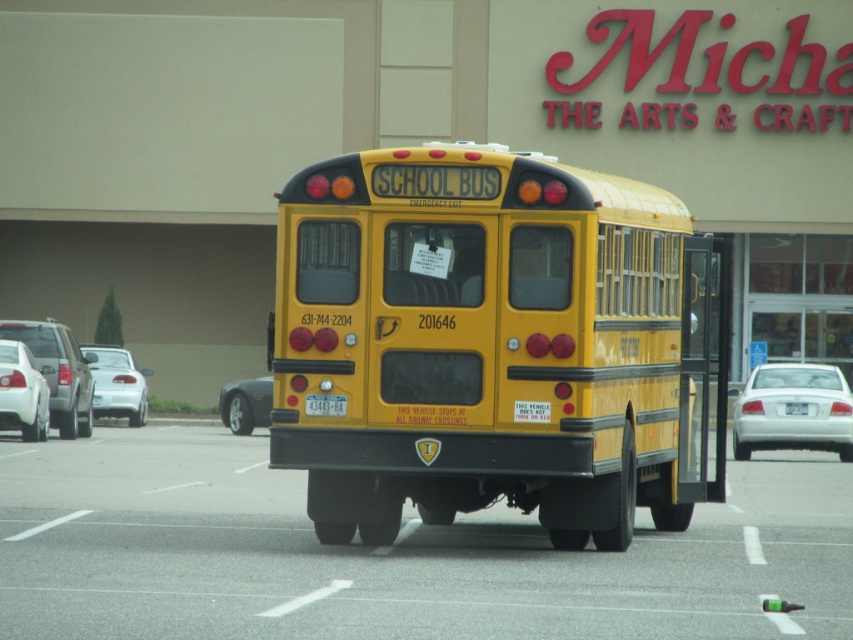
From the picture: Which of these two, yellow matte/solid school bus at center or yellow matte school bus at center, stands shorter?

yellow matte school bus at center is shorter.

Which is more to the left, yellow matte/solid school bus at center or yellow matte school bus at center?

yellow matte school bus at center is more to the left.

Image resolution: width=853 pixels, height=640 pixels. Describe the element at coordinates (495, 344) in the screenshot. I see `yellow matte/solid school bus at center` at that location.

At what (x,y) coordinates should I click in order to perform the action: click on yellow matte/solid school bus at center. Please return your answer as a coordinate pair (x, y). The width and height of the screenshot is (853, 640). Looking at the image, I should click on (495, 344).

Which is more to the right, yellow matte school bus at center or white glossy sedan at left?

Positioned to the right is yellow matte school bus at center.

Is point (62, 625) positioned before point (19, 394)?

Yes, point (62, 625) is closer to viewer.

The height and width of the screenshot is (640, 853). I want to click on yellow matte school bus at center, so 390,554.

Does yellow matte/solid school bus at center have a smaller size compared to white glossy sedan at left?

No.

Which of these two, yellow matte/solid school bus at center or white glossy sedan at left, stands shorter?

white glossy sedan at left is shorter.

Does point (291, 316) lie in front of point (18, 353)?

That is True.

Identify the location of yellow matte/solid school bus at center. (495, 344).